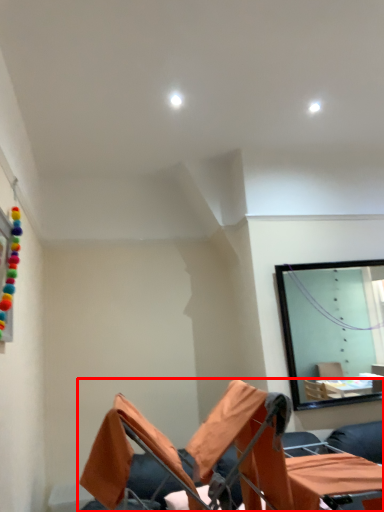
Question: Considering the relative positions of furniture (annotated by the red box) and table in the image provided, where is furniture (annotated by the red box) located with respect to the staircase?

Choices:
 (A) right
 (B) left

Answer: (B)